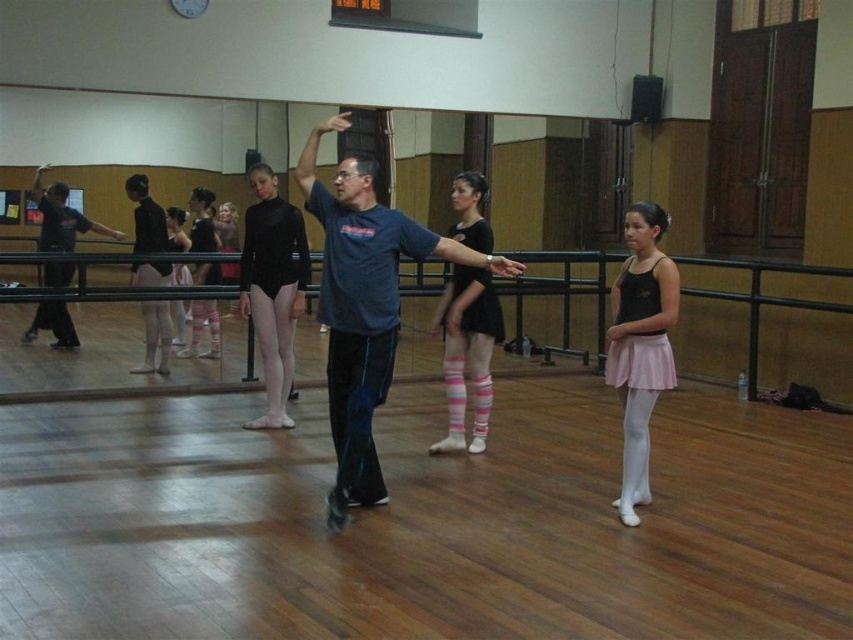
Is pink striped tights at center to the left of pink satin ballet skirt at lower right from the viewer's perspective?

Yes, pink striped tights at center is to the left of pink satin ballet skirt at lower right.

Is pink striped tights at center thinner than pink satin ballet skirt at lower right?

Incorrect, pink striped tights at center's width is not less than pink satin ballet skirt at lower right's.

You are a GUI agent. You are given a task and a screenshot of the screen. Output one action in this format:
    pyautogui.click(x=<x>, y=<y>)
    Task: Click on the pink striped tights at center
    The height and width of the screenshot is (640, 853).
    Given the screenshot: What is the action you would take?
    (x=467, y=353)

Can you confirm if pink satin skirt at lower right is smaller than black leotard at center?

Indeed, pink satin skirt at lower right has a smaller size compared to black leotard at center.

Which is more to the right, pink satin skirt at lower right or black leotard at center?

pink satin skirt at lower right is more to the right.

Does point (653, 332) come behind point (277, 337)?

No, (653, 332) is in front of (277, 337).

What are the coordinates of `pink satin skirt at lower right` in the screenshot? It's located at (640, 344).

Can you confirm if pink satin skirt at lower right is positioned to the left of pink satin ballet skirt at lower right?

Correct, you'll find pink satin skirt at lower right to the left of pink satin ballet skirt at lower right.

Which is in front, point (660, 362) or point (646, 349)?

Point (646, 349) is more forward.

Find the location of a particular element. This screenshot has width=853, height=640. pink satin skirt at lower right is located at coordinates (640, 344).